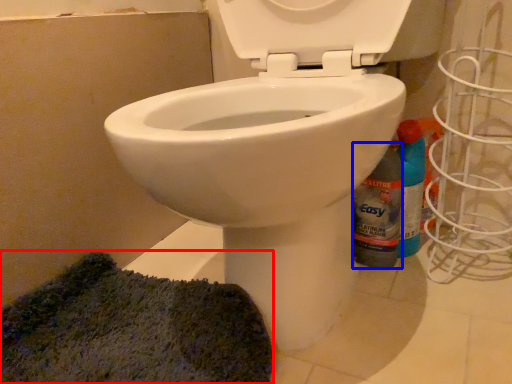
Question: Which of the following is the closest to the observer, doormat (highlighted by a red box) or bottle (highlighted by a blue box)?

Choices:
 (A) doormat
 (B) bottle

Answer: (A)